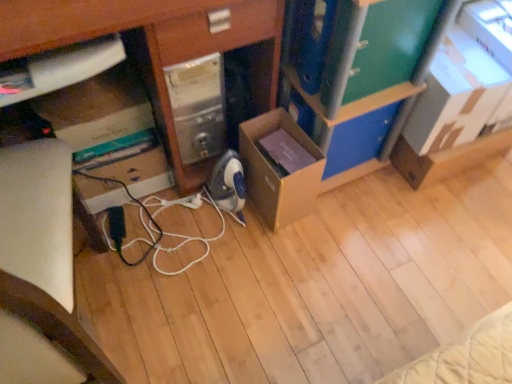
You are a GUI agent. You are given a task and a screenshot of the screen. Output one action in this format:
    pyautogui.click(x=<x>, y=<y>)
    Task: Click on the blank space situated above cardboard box at upper right, the first cardboard box from the right (from a real-world perspective)
    This screenshot has width=512, height=384.
    Given the screenshot: What is the action you would take?
    pyautogui.click(x=465, y=55)